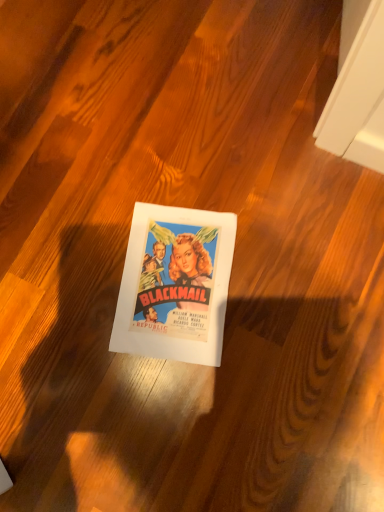
The image size is (384, 512). In order to click on vacant space situated above white paper poster at center (from a real-world perspective) in this screenshot , I will do `click(174, 283)`.